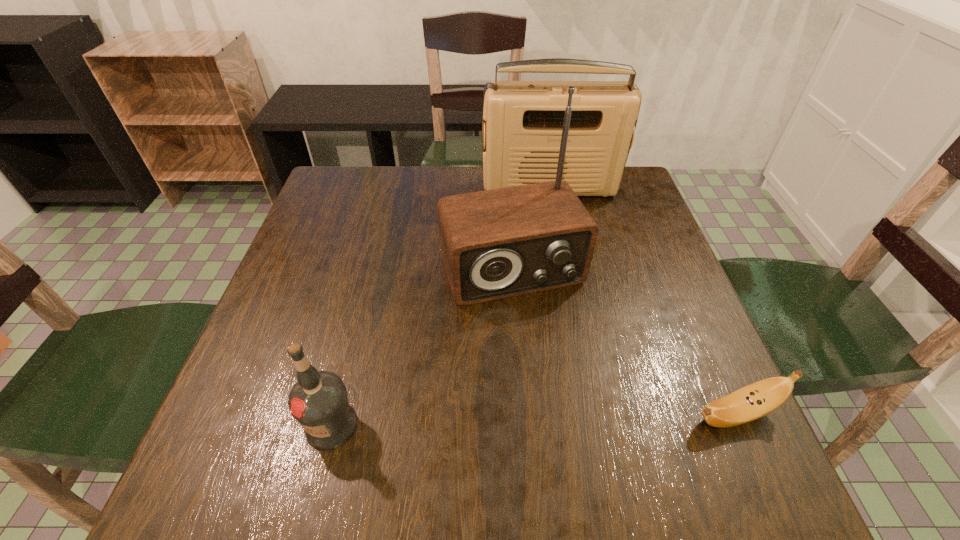
Where is `free space located 0.350m on the front-facing side of the farther radio receiver`? Image resolution: width=960 pixels, height=540 pixels. free space located 0.350m on the front-facing side of the farther radio receiver is located at coordinates (570, 292).

The image size is (960, 540). In order to click on vacant space located on the front-facing side of the farther radio receiver in this screenshot , I will do (573, 306).

The height and width of the screenshot is (540, 960). Find the location of `object that is at the far edge`. object that is at the far edge is located at coordinates (524, 120).

Identify the location of vodka located in the near edge section of the desktop. The image size is (960, 540). (319, 402).

Image resolution: width=960 pixels, height=540 pixels. Find the location of `banana that is at the near edge`. banana that is at the near edge is located at coordinates (758, 399).

This screenshot has width=960, height=540. Identify the location of object that is at the left edge. (319, 402).

What are the coordinates of `banana situated at the right edge` in the screenshot? It's located at (758, 399).

Locate an element on the screen. The image size is (960, 540). radio receiver that is at the right edge is located at coordinates (524, 120).

You are a GUI agent. You are given a task and a screenshot of the screen. Output one action in this format:
    pyautogui.click(x=<x>, y=<y>)
    Task: Click on the object located in the near left corner section of the desktop
    The image size is (960, 540).
    Given the screenshot: What is the action you would take?
    pyautogui.click(x=319, y=402)

Locate an element on the screen. The width and height of the screenshot is (960, 540). object located at the far right corner is located at coordinates (524, 120).